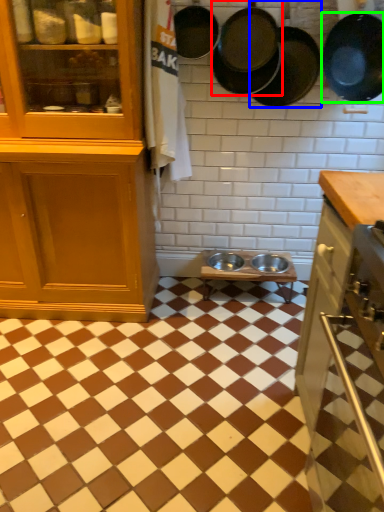
Question: Estimate the real-world distances between objects in this image. Which object is closer to frying pan (highlighted by a red box), frying pan (highlighted by a blue box) or frying pan (highlighted by a green box)?

Choices:
 (A) frying pan
 (B) frying pan

Answer: (A)